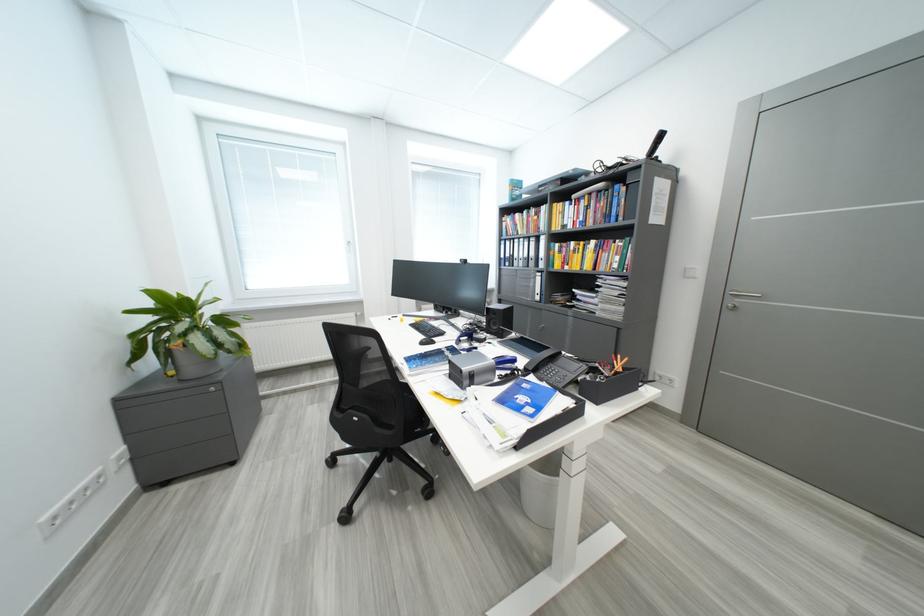
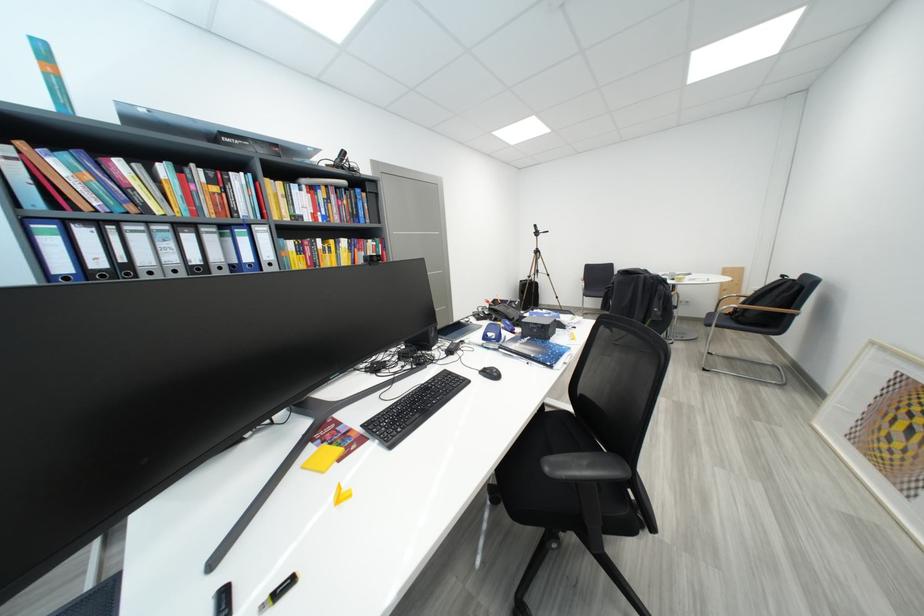
Locate, in the second image, the point that corresponds to point 565,182 in the first image.

(286, 148)